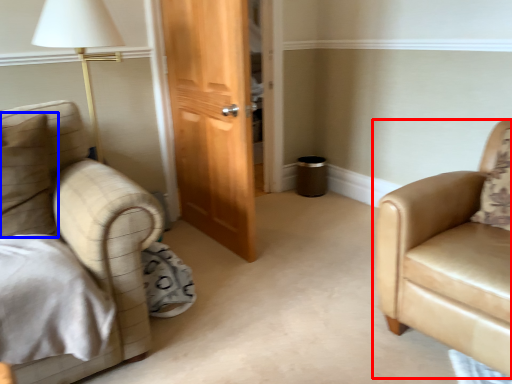
Question: Which object appears closest to the camera in this image, chair (highlighted by a red box) or pillow (highlighted by a blue box)?

Choices:
 (A) chair
 (B) pillow

Answer: (A)